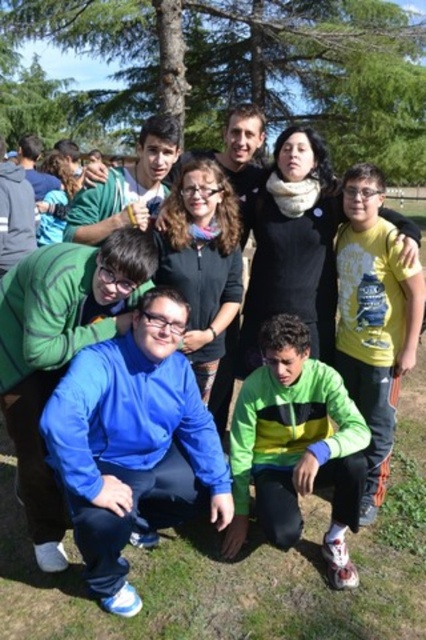
Question: Is blue fleece jacket at center thinner than green/yellow striped jacket at center?

Choices:
 (A) no
 (B) yes

Answer: (A)

Question: Does green leafy tree at upper center have a smaller size compared to blue fleece jacket at center?

Choices:
 (A) no
 (B) yes

Answer: (A)

Question: Which object appears farthest from the camera in this image?

Choices:
 (A) green leafy tree at upper center
 (B) green/yellow striped jacket at center

Answer: (A)

Question: Considering the real-world distances, which object is farthest from the green leafy tree at upper center?

Choices:
 (A) green/yellow striped jacket at center
 (B) blue fleece jacket at center

Answer: (B)

Question: Among these objects, which one is farthest from the camera?

Choices:
 (A) green/yellow striped jacket at center
 (B) blue fleece jacket at center

Answer: (A)

Question: Can you confirm if green leafy tree at upper center is wider than green/yellow striped jacket at center?

Choices:
 (A) yes
 (B) no

Answer: (A)